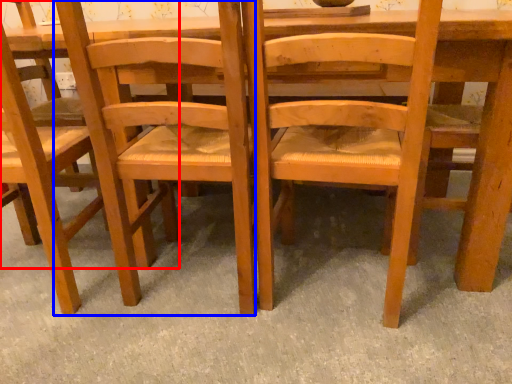
Question: Which object is closer to the camera taking this photo, chair (highlighted by a red box) or chair (highlighted by a blue box)?

Choices:
 (A) chair
 (B) chair

Answer: (B)